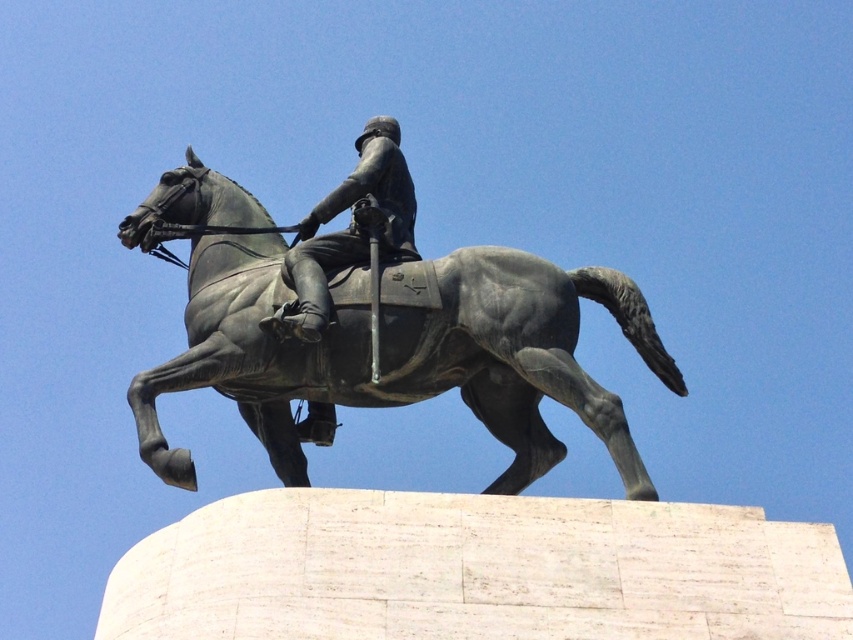
Is bronze statue at center to the left of polished bronze helmet at center from the viewer's perspective?

In fact, bronze statue at center is to the right of polished bronze helmet at center.

Does bronze statue at center have a lesser width compared to polished bronze helmet at center?

No, bronze statue at center is not thinner than polished bronze helmet at center.

The image size is (853, 640). I want to click on bronze statue at center, so [404, 353].